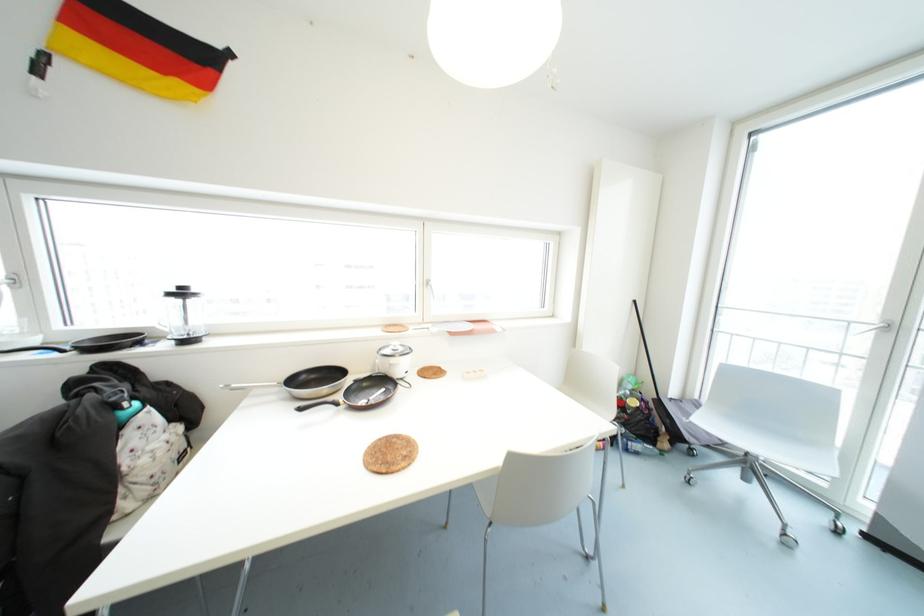
Where is `black pan handle`? The height and width of the screenshot is (616, 924). black pan handle is located at coordinates (30, 347).